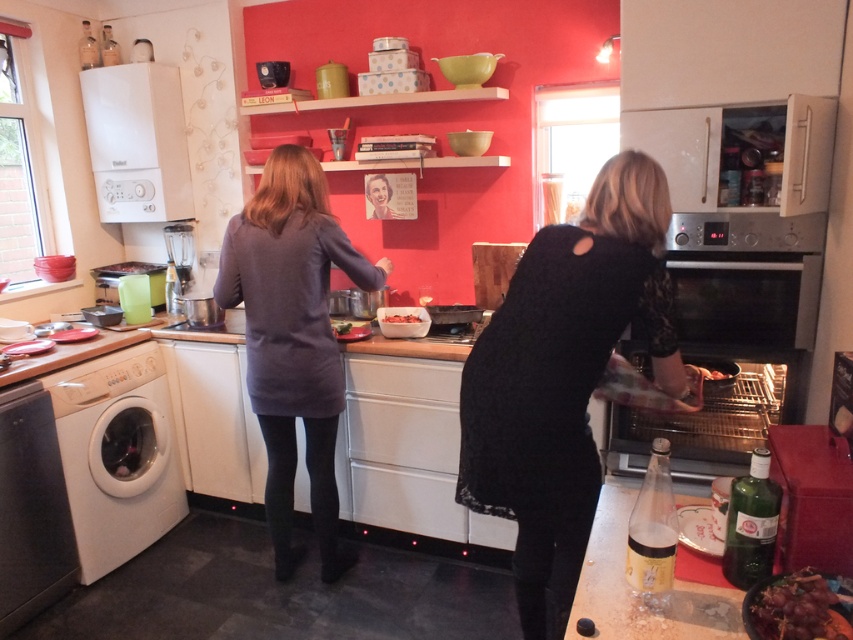
Question: Can you confirm if white plastic washing machine at lower left is smaller than smooth plastic portrait at center?

Choices:
 (A) yes
 (B) no

Answer: (B)

Question: Which object is the farthest from the black matte dishwasher at lower left?

Choices:
 (A) white plastic washing machine at lower left
 (B) black lace dress at center

Answer: (B)

Question: Can you confirm if shiny purple grapes at lower right is positioned to the right of smooth plastic portrait at center?

Choices:
 (A) yes
 (B) no

Answer: (A)

Question: Is silver metallic oven at right above white plastic washing machine at lower left?

Choices:
 (A) yes
 (B) no

Answer: (A)

Question: Which object appears farthest from the camera in this image?

Choices:
 (A) silver metallic oven at right
 (B) white plastic washing machine at lower left
 (C) white plastic boiler at upper left

Answer: (C)

Question: Which object is positioned closest to the smooth plastic portrait at center?

Choices:
 (A) smooth brown chocolate bar at center
 (B) white plastic boiler at upper left
 (C) dark gray sweater at center
 (D) shiny purple grapes at lower right

Answer: (A)